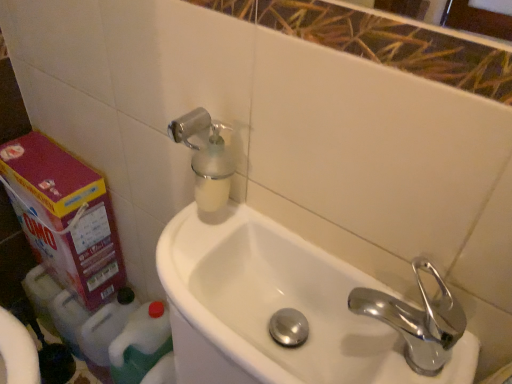
Where is `pink cardboard carton at left`? pink cardboard carton at left is located at coordinates (65, 216).

From the image's perspective, is pink cardboard carton at left above or below translucent plastic soap dispenser at upper left?

Clearly, from the image's perspective, pink cardboard carton at left is below translucent plastic soap dispenser at upper left.

Which is farther, (18, 151) or (220, 174)?

The point (18, 151) is farther from the camera.

Between pink cardboard carton at left and translucent plastic soap dispenser at upper left, which one has larger width?

pink cardboard carton at left.

Locate an element on the screen. The width and height of the screenshot is (512, 384). carton below the translucent plastic soap dispenser at upper left (from a real-world perspective) is located at coordinates (65, 216).

Does translucent plastic soap dispenser at upper left lie behind white plastic bottle at lower left?

No, translucent plastic soap dispenser at upper left is closer to the camera.

From their relative heights in the image, would you say translucent plastic soap dispenser at upper left is taller or shorter than white plastic bottle at lower left?

In the image, translucent plastic soap dispenser at upper left appears to be shorter than white plastic bottle at lower left.

Is translucent plastic soap dispenser at upper left turned away from white plastic bottle at lower left?

translucent plastic soap dispenser at upper left does not have its back to white plastic bottle at lower left.

Identify the location of cleaning product lying behind the translucent plastic soap dispenser at upper left. (140, 343).

From a real-world perspective, is white plastic bottle at lower left above or below translucent plastic soap dispenser at upper left?

white plastic bottle at lower left is situated lower than translucent plastic soap dispenser at upper left in the real world.

Does white plastic bottle at lower left have a greater height compared to translucent plastic soap dispenser at upper left?

Yes, white plastic bottle at lower left is taller than translucent plastic soap dispenser at upper left.

Considering the sizes of white plastic bottle at lower left and translucent plastic soap dispenser at upper left in the image, is white plastic bottle at lower left wider or thinner than translucent plastic soap dispenser at upper left?

Considering their sizes, white plastic bottle at lower left looks broader than translucent plastic soap dispenser at upper left.

Which of these two, white plastic bottle at lower left or translucent plastic soap dispenser at upper left, is smaller?

With smaller size is translucent plastic soap dispenser at upper left.

How far apart are white plastic bottle at lower left and white glossy sink at center?

A distance of 51.83 centimeters exists between white plastic bottle at lower left and white glossy sink at center.

From the image's perspective, is white plastic bottle at lower left positioned above or below white glossy sink at center?

From the image's perspective, white plastic bottle at lower left appears below white glossy sink at center.

From their relative heights in the image, would you say white plastic bottle at lower left is taller or shorter than white glossy sink at center?

Clearly, white plastic bottle at lower left is taller compared to white glossy sink at center.

Which is more to the right, chrome metallic faucet at right or white glossy sink at center?

From the viewer's perspective, chrome metallic faucet at right appears more on the right side.

Considering the positions of objects chrome metallic faucet at right and white glossy sink at center in the image provided, who is in front, chrome metallic faucet at right or white glossy sink at center?

white glossy sink at center is in front.

In the scene shown: Is chrome metallic faucet at right looking in the opposite direction of white glossy sink at center?

That's not correct — chrome metallic faucet at right is not looking away from white glossy sink at center.

Is chrome metallic faucet at right far from white glossy sink at center?

No, chrome metallic faucet at right is not far away from white glossy sink at center.

Which object is positioned more to the right, chrome metallic faucet at right or translucent plastic soap dispenser at upper left?

From the viewer's perspective, chrome metallic faucet at right appears more on the right side.

Considering the positions of point (356, 306) and point (234, 170), is point (356, 306) closer or farther from the camera than point (234, 170)?

Clearly, point (356, 306) is closer to the camera than point (234, 170).

Between chrome metallic faucet at right and translucent plastic soap dispenser at upper left, which one has smaller size?

With smaller size is chrome metallic faucet at right.

Locate an element on the screen. soap dispenser behind the chrome metallic faucet at right is located at coordinates (206, 158).

Is translucent plastic soap dispenser at upper left turned away from chrome metallic faucet at right?

No, translucent plastic soap dispenser at upper left's orientation is not away from chrome metallic faucet at right.

Identify the location of soap dispenser behind the chrome metallic faucet at right. This screenshot has width=512, height=384. (206, 158).

Is translucent plastic soap dispenser at upper left not close to chrome metallic faucet at right?

No, there isn't a large distance between translucent plastic soap dispenser at upper left and chrome metallic faucet at right.

Can you confirm if translucent plastic soap dispenser at upper left is shorter than chrome metallic faucet at right?

No, translucent plastic soap dispenser at upper left is not shorter than chrome metallic faucet at right.

In order to click on soap dispenser that appears above the pink cardboard carton at left (from a real-world perspective) in this screenshot , I will do click(x=206, y=158).

Identify the location of cleaning product located below the translucent plastic soap dispenser at upper left (from the image's perspective). This screenshot has height=384, width=512. (140, 343).

When comparing their distances from translucent plastic soap dispenser at upper left, does white plastic bottle at lower left or white glossy sink at center seem closer?

white glossy sink at center.

Looking at the image, which one is located further to white glossy sink at center, pink cardboard carton at left or chrome metallic faucet at right?

pink cardboard carton at left lies further to white glossy sink at center than the other object.

Looking at the image, which one is located further to chrome metallic faucet at right, white plastic bottle at lower left or pink cardboard carton at left?

The object further to chrome metallic faucet at right is pink cardboard carton at left.

From the image, which object appears to be nearer to chrome metallic faucet at right, translucent plastic soap dispenser at upper left or white glossy sink at center?

white glossy sink at center is closer to chrome metallic faucet at right.

From the image, which object appears to be nearer to white glossy sink at center, translucent plastic soap dispenser at upper left or white plastic bottle at lower left?

The object closer to white glossy sink at center is translucent plastic soap dispenser at upper left.

Based on their spatial positions, is white plastic bottle at lower left or chrome metallic faucet at right closer to translucent plastic soap dispenser at upper left?

chrome metallic faucet at right is closer to translucent plastic soap dispenser at upper left.

When comparing their distances from white glossy sink at center, does chrome metallic faucet at right or translucent plastic soap dispenser at upper left seem closer?

Based on the image, chrome metallic faucet at right appears to be nearer to white glossy sink at center.

Looking at this image, estimate the real-world distances between objects in this image. Which object is closer to white plastic bottle at lower left, white glossy sink at center or pink cardboard carton at left?

pink cardboard carton at left is positioned closer to the anchor white plastic bottle at lower left.

Identify the location of carton between white glossy sink at center and white plastic bottle at lower left along the z-axis. (65, 216).

Identify the location of soap dispenser between white glossy sink at center and white plastic bottle at lower left in the front-back direction. (206, 158).

Find the location of a particular element. soap dispenser between pink cardboard carton at left and white glossy sink at center is located at coordinates (206, 158).

What are the coordinates of `cleaning product located between pink cardboard carton at left and chrome metallic faucet at right in the left-right direction` in the screenshot? It's located at (140, 343).